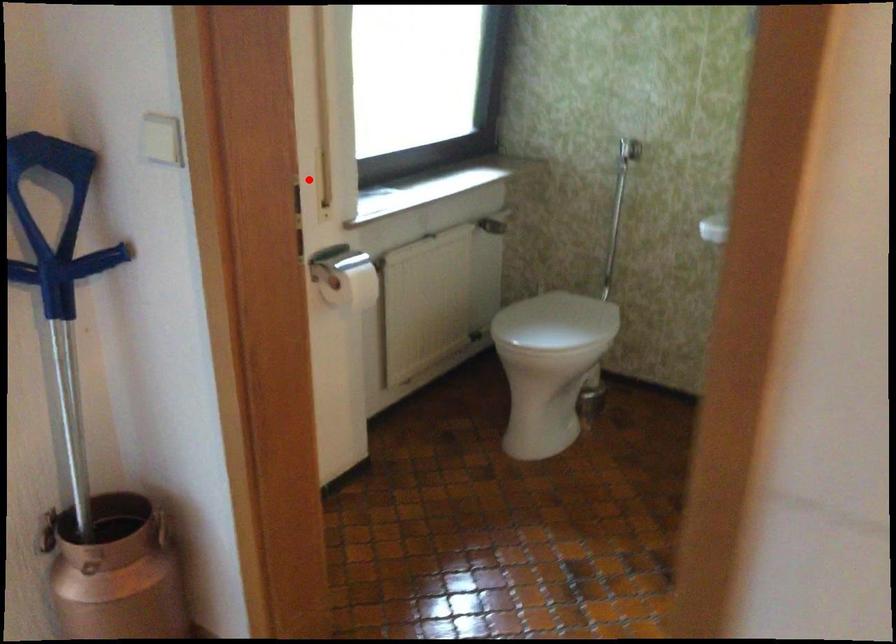
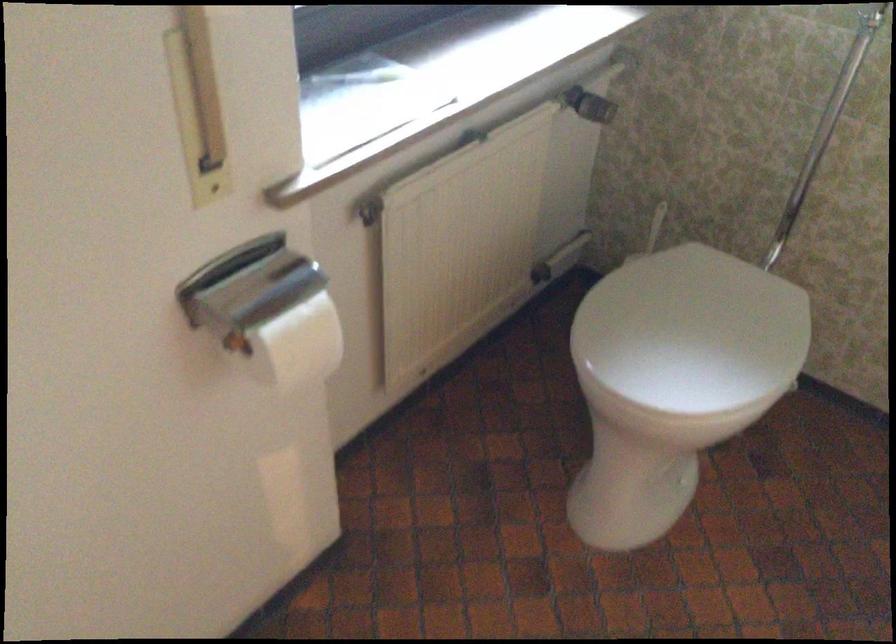
Find the pixel in the second image that matches the highlighted location in the first image.

(197, 106)